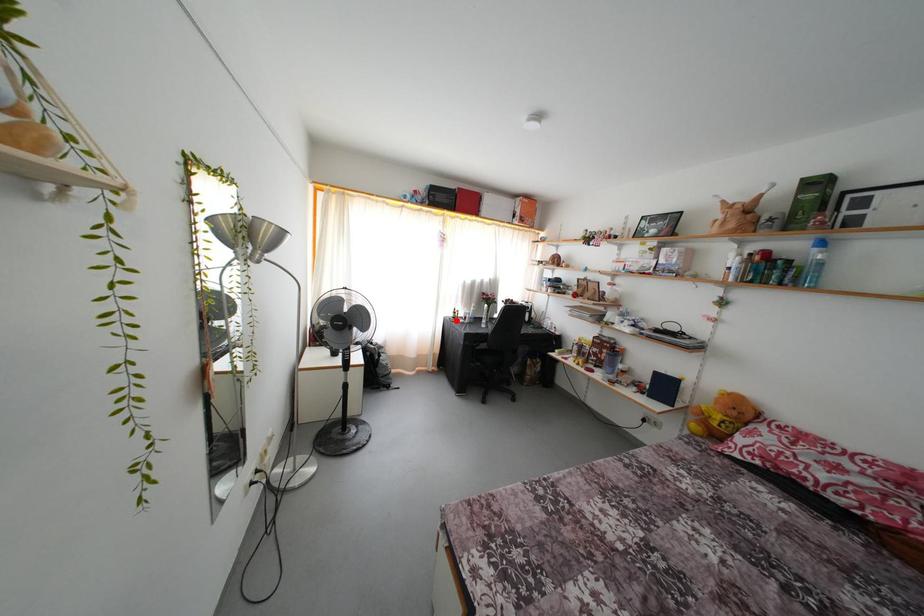
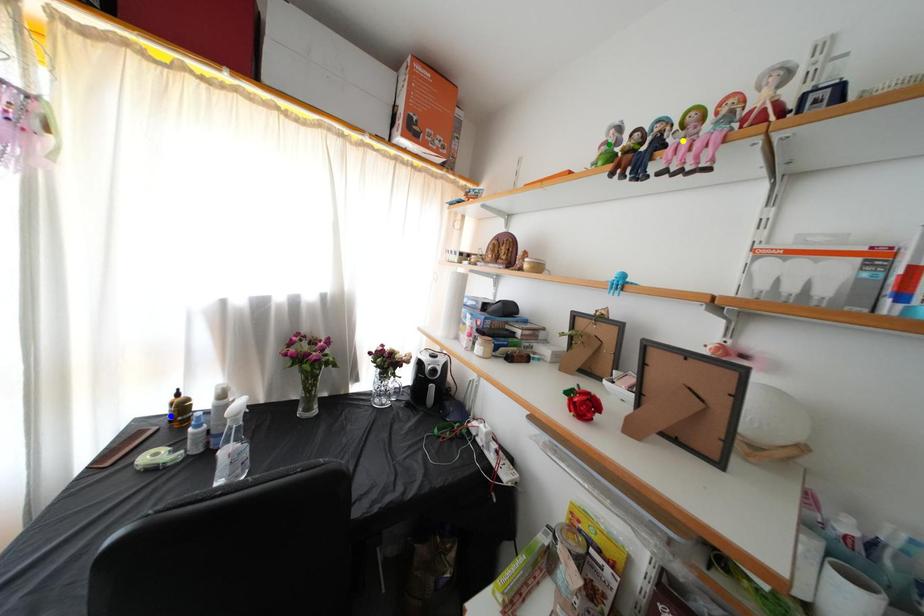
Question: I am providing you with two images of the same scene from different viewpoints. A red point is marked on the first image. You are given multiple points on the second image. In image 2, which mark is for the same physical point as the one in image 1?

Choices:
 (A) yellow point
 (B) green point
 (C) blue point

Answer: (C)